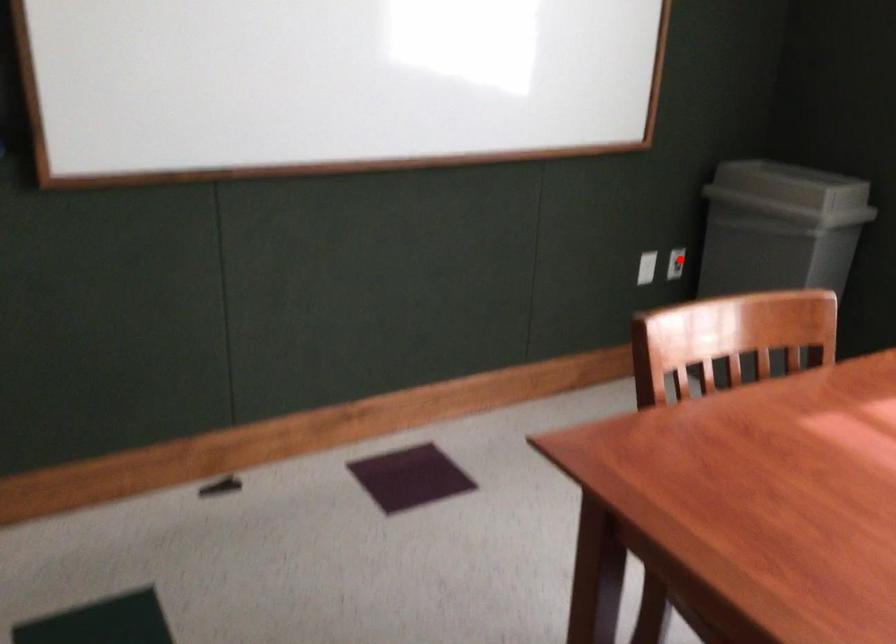
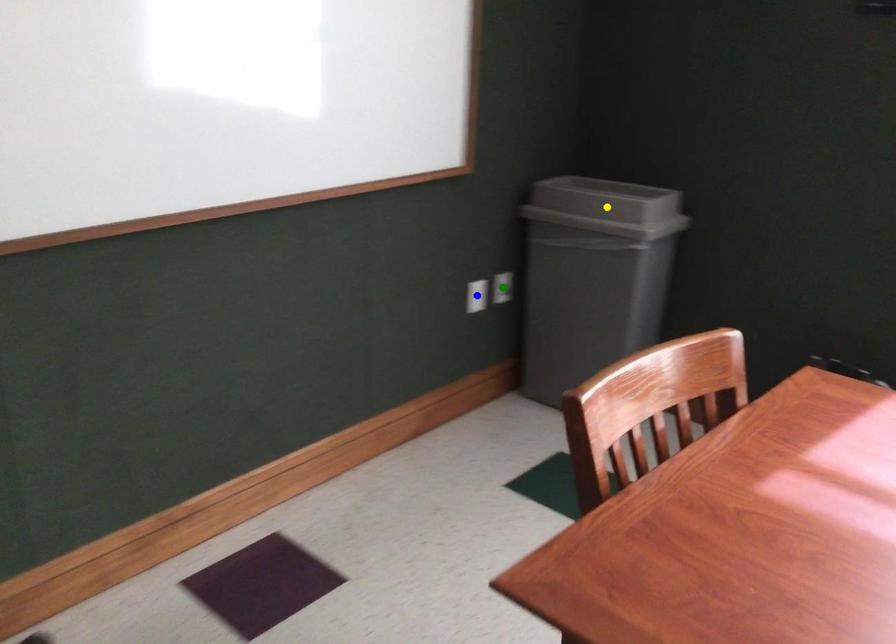
Question: I am providing you with two images of the same scene from different viewpoints. A red point is marked on the first image. You are given multiple points on the second image. Which point in image 2 represents the same 3d spot as the red point in image 1?

Choices:
 (A) blue point
 (B) green point
 (C) yellow point

Answer: (B)